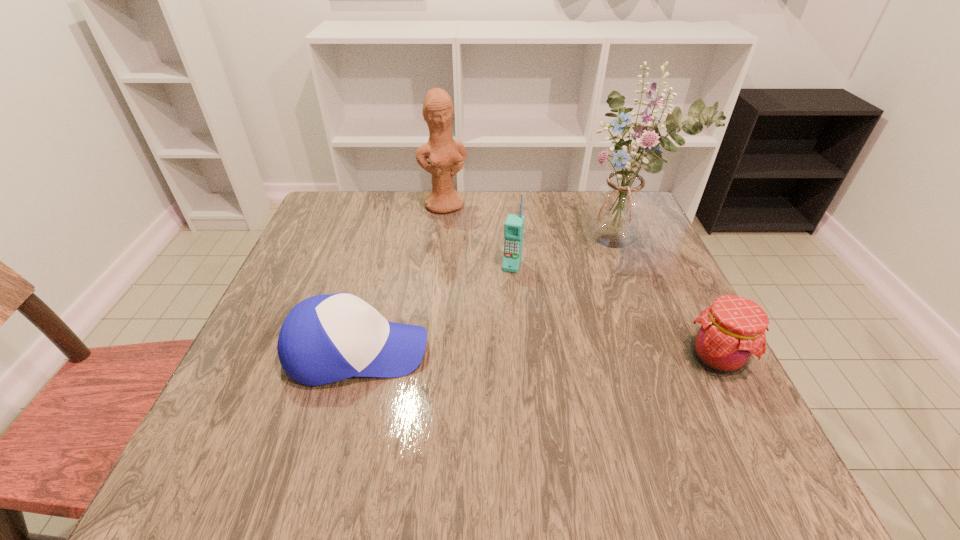
The width and height of the screenshot is (960, 540). What are the coordinates of `empty space that is in between the jam and the third object from left to right` in the screenshot? It's located at (614, 312).

Select which object appears as the fourth closest to the second tallest object. Please provide its 2D coordinates. Your answer should be formatted as a tuple, i.e. [(x, y)], where the tuple contains the x and y coordinates of a point satisfying the conditions above.

[(730, 333)]

Point out which object is positioned as the fourth nearest to the jam. Please provide its 2D coordinates. Your answer should be formatted as a tuple, i.e. [(x, y)], where the tuple contains the x and y coordinates of a point satisfying the conditions above.

[(446, 156)]

Find the location of `free region that satisfies the following two spatial constraints: 1. on the front side of the third tallest object; 2. on the right side of the figurine`. free region that satisfies the following two spatial constraints: 1. on the front side of the third tallest object; 2. on the right side of the figurine is located at coordinates (437, 265).